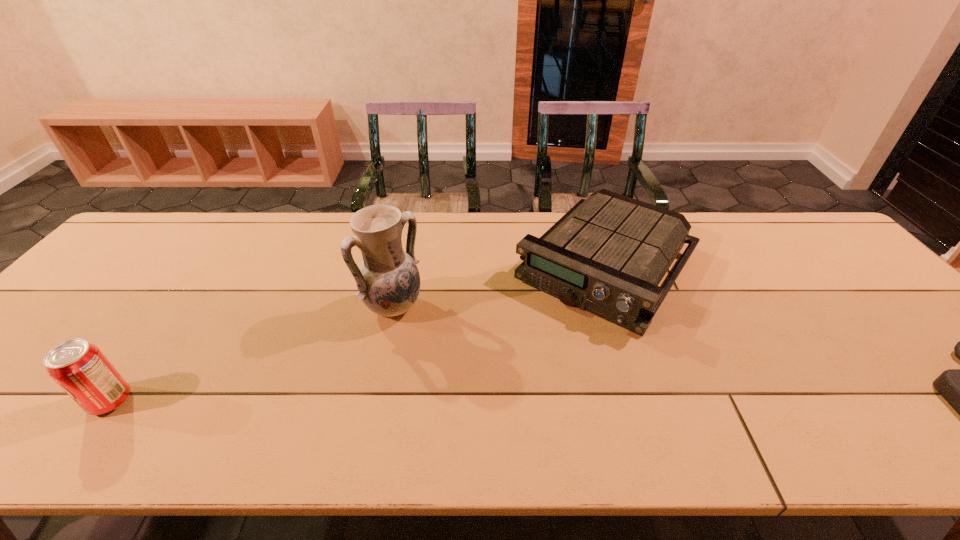
This screenshot has height=540, width=960. What are the coordinates of `the leftmost object` in the screenshot? It's located at (80, 368).

This screenshot has width=960, height=540. In order to click on radio receiver in this screenshot , I will do [x=607, y=255].

Identify the location of the shortest object. Image resolution: width=960 pixels, height=540 pixels. (607, 255).

The width and height of the screenshot is (960, 540). I want to click on the third object from right to left, so click(x=388, y=281).

Locate an element on the screen. The height and width of the screenshot is (540, 960). the tallest object is located at coordinates (388, 281).

You are a GUI agent. You are given a task and a screenshot of the screen. Output one action in this format:
    pyautogui.click(x=<x>, y=<y>)
    Task: Click on the vacant space positioned on the back of the leftmost object
    This screenshot has width=960, height=540.
    Given the screenshot: What is the action you would take?
    pyautogui.click(x=179, y=308)

The width and height of the screenshot is (960, 540). What are the coordinates of `free location located on the front panel of the third object from left to right` in the screenshot? It's located at (531, 359).

This screenshot has width=960, height=540. Find the location of `free location located on the front panel of the third object from left to right`. free location located on the front panel of the third object from left to right is located at coordinates (492, 408).

The height and width of the screenshot is (540, 960). What are the coordinates of `vacant space situated on the front panel of the third object from left to right` in the screenshot? It's located at (531, 359).

Identify the location of vacant point located on either side of the third object from right to left. The image size is (960, 540). (446, 352).